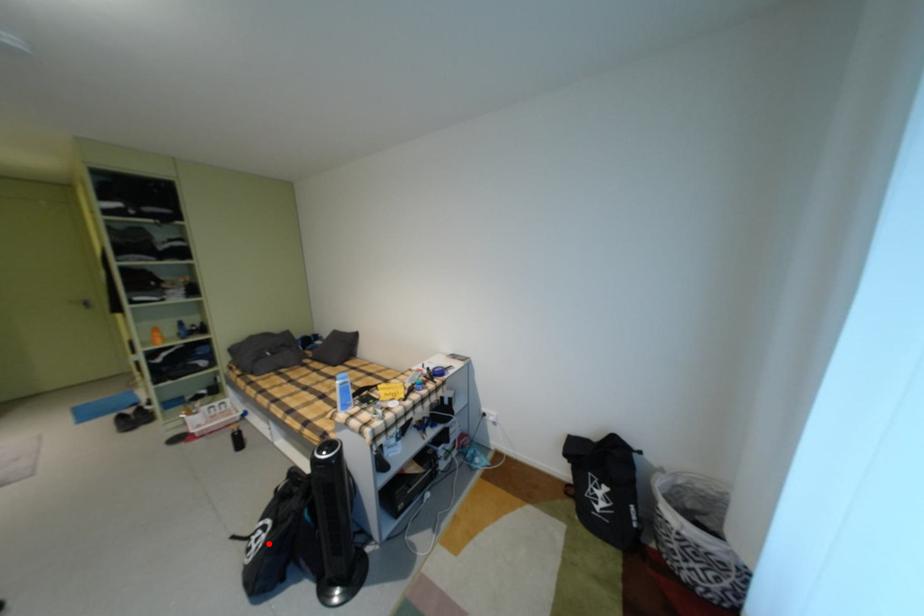
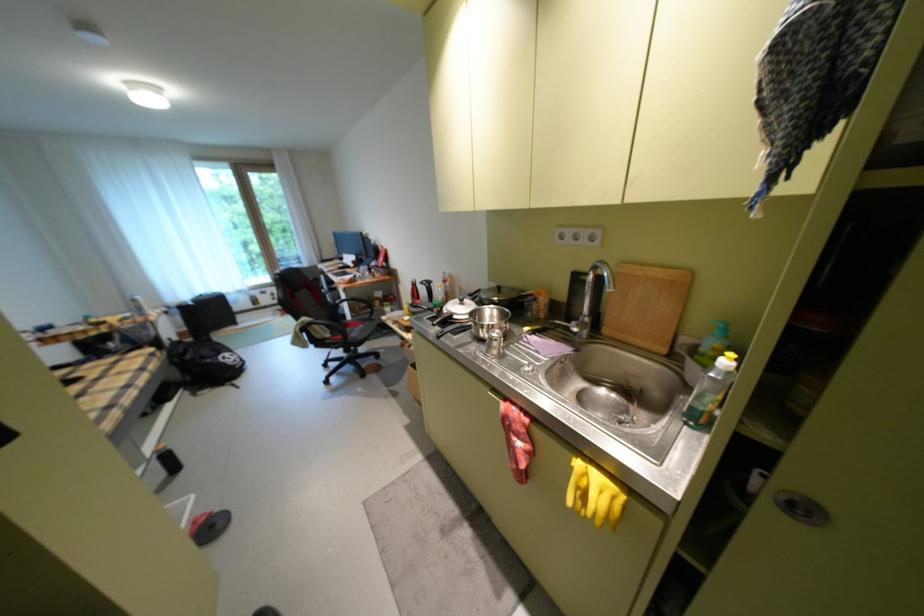
Question: I am providing you with two images of the same scene from different viewpoints. Given a red point in image1, look at the same physical point in image2. Is it:

Choices:
 (A) Closer to the viewpoint
 (B) Farther from the viewpoint

Answer: (A)